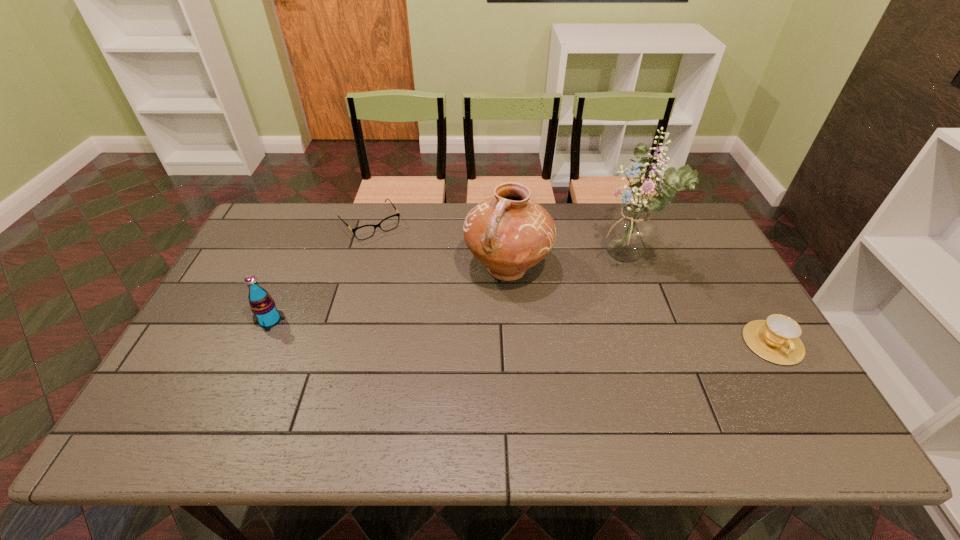
Find the location of a particular element. free space on the desktop that is between the third tallest object and the cup and is positioned on the front-facing side of the tallest object is located at coordinates (450, 328).

Locate an element on the screen. This screenshot has width=960, height=540. free space on the desktop that is between the leftmost object and the cup and is positioned on the side of the pottery with the handle is located at coordinates (454, 328).

This screenshot has height=540, width=960. In order to click on vacant space on the desktop that is between the soda and the cup and is positioned on the front-facing side of the spectacles in this screenshot , I will do `click(450, 328)`.